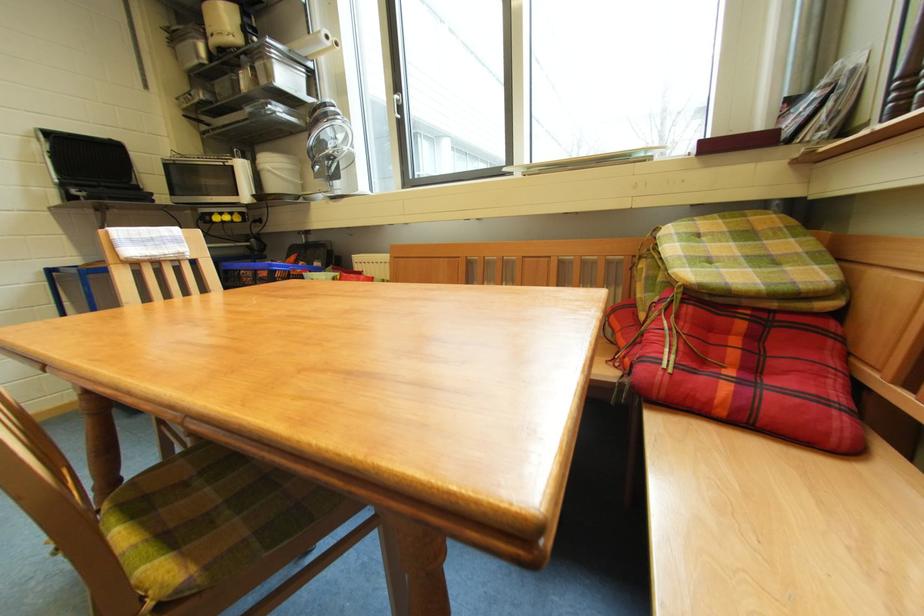
Find where to pull the paper towel roll. Please return your answer as a coordinate pair (x, y).

(313, 44)